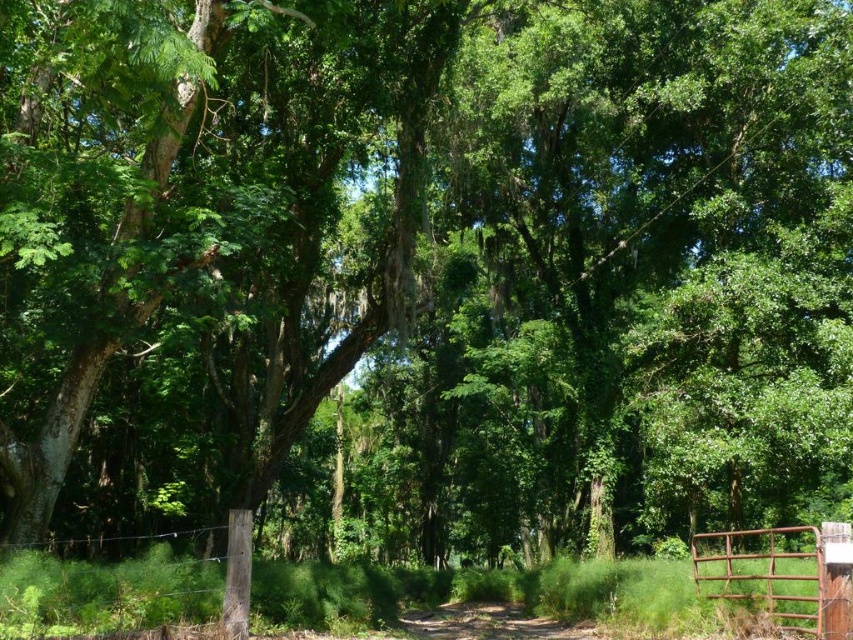
Is rusty metal gate at lower right taller than brown dirt track at center?

No.

Which is in front, point (813, 600) or point (573, 637)?

Positioned in front is point (813, 600).

The image size is (853, 640). In order to click on rusty metal gate at lower right in this screenshot , I will do `click(782, 573)`.